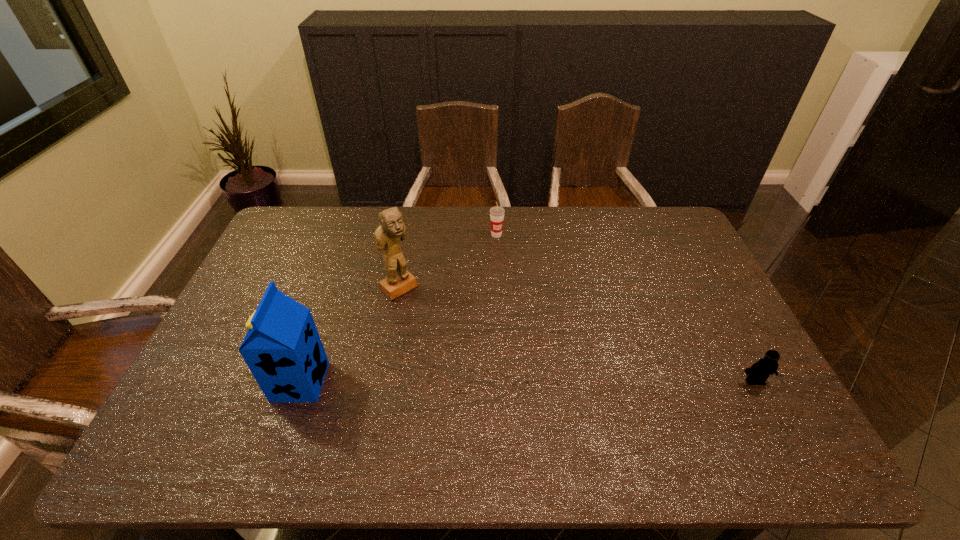
Identify the location of carton. (282, 348).

Where is `the shortest object`? the shortest object is located at coordinates (759, 372).

The height and width of the screenshot is (540, 960). What are the coordinates of `the rightmost object` in the screenshot? It's located at (759, 372).

This screenshot has height=540, width=960. Identify the location of figurine. (391, 231).

The image size is (960, 540). What are the coordinates of `the third object from right to left` in the screenshot? It's located at (391, 231).

This screenshot has width=960, height=540. In order to click on cup in this screenshot , I will do `click(496, 213)`.

What are the coordinates of `the second shortest object` in the screenshot? It's located at (496, 213).

Find the location of a particular element. vacant space situated 0.150m with the cap open on the carton is located at coordinates (218, 382).

This screenshot has height=540, width=960. Identify the location of vacant space located with the cap open on the carton. (206, 382).

The height and width of the screenshot is (540, 960). Find the location of `free space located on the face of the shortest object`. free space located on the face of the shortest object is located at coordinates (773, 415).